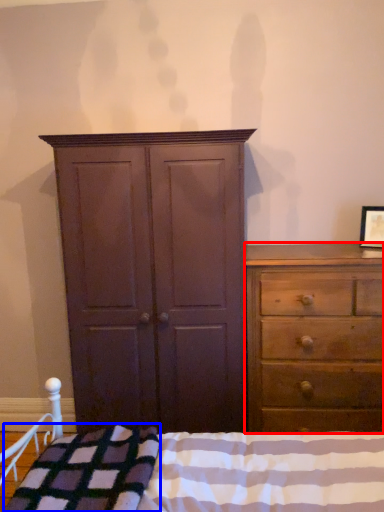
Question: Which of the following is the closest to the observer, chest of drawers (highlighted by a red box) or blanket (highlighted by a blue box)?

Choices:
 (A) chest of drawers
 (B) blanket

Answer: (B)